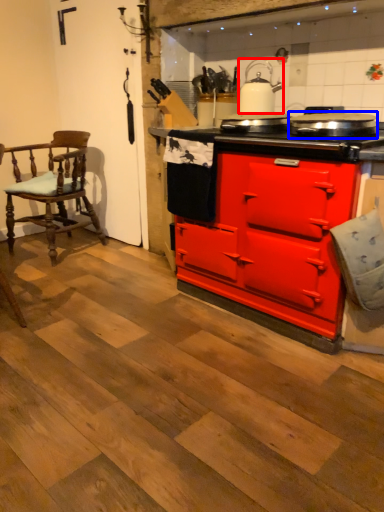
Question: Among these objects, which one is farthest to the camera, kitchen appliance (highlighted by a red box) or appliance (highlighted by a blue box)?

Choices:
 (A) kitchen appliance
 (B) appliance

Answer: (A)